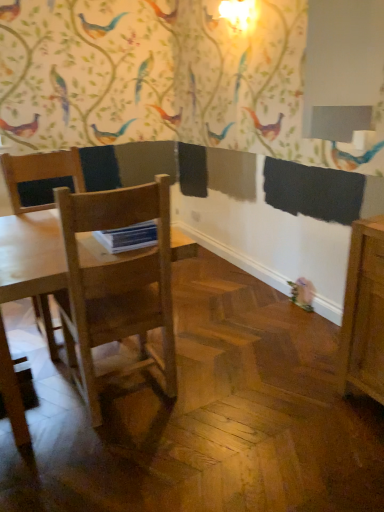
Question: In terms of width, does light wood table at center look wider or thinner when compared to light brown wood chair at left?

Choices:
 (A) wide
 (B) thin

Answer: (B)

Question: Considering the positions of light wood table at center and light brown wood chair at left in the image, is light wood table at center taller or shorter than light brown wood chair at left?

Choices:
 (A) tall
 (B) short

Answer: (A)

Question: Do you think light wood table at center is within light brown wood chair at left, or outside of it?

Choices:
 (A) outside
 (B) inside

Answer: (A)

Question: In terms of size, does light brown wood chair at left appear bigger or smaller than light wood table at center?

Choices:
 (A) big
 (B) small

Answer: (A)

Question: Visually, is light brown wood chair at left positioned to the left or to the right of light wood table at center?

Choices:
 (A) left
 (B) right

Answer: (A)

Question: From a real-world perspective, is light brown wood chair at left above or below light wood table at center?

Choices:
 (A) below
 (B) above

Answer: (A)

Question: Choose the correct answer: Is light brown wood chair at left inside light wood table at center or outside it?

Choices:
 (A) outside
 (B) inside

Answer: (A)